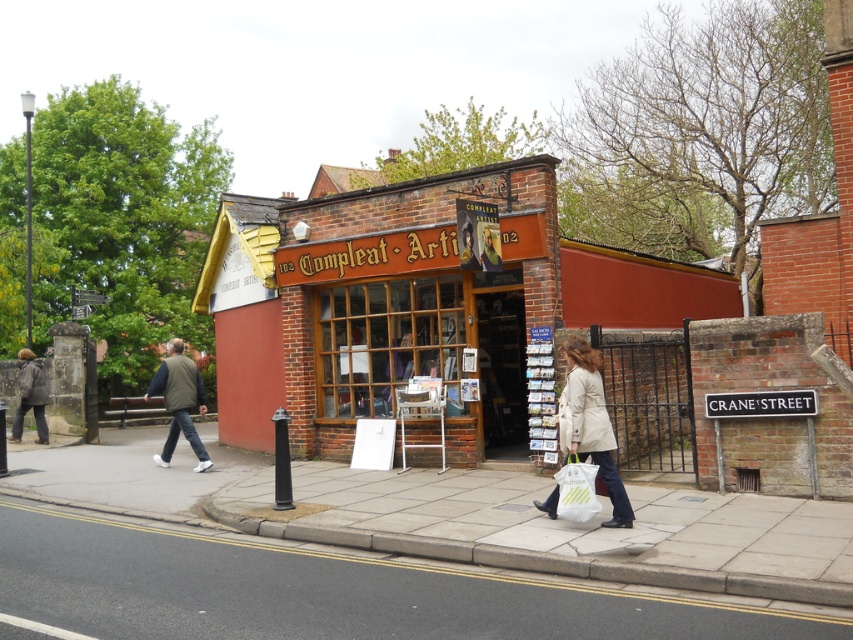
Who is more forward, (x=589, y=381) or (x=22, y=374)?

Point (x=589, y=381)

Does light beige coat at lower right have a greater height compared to dark gray jacket at lower left?

No.

Does point (598, 358) come farther from viewer compared to point (33, 404)?

No, (598, 358) is closer to viewer.

At what (x,y) coordinates should I click in order to perform the action: click on light beige coat at lower right. Please return your answer as a coordinate pair (x, y). The image size is (853, 640). Looking at the image, I should click on (590, 424).

Is brick storefront at center wider than dark gray jacket at lower left?

No.

Does brick storefront at center have a lesser height compared to dark gray jacket at lower left?

Yes.

You are a GUI agent. You are given a task and a screenshot of the screen. Output one action in this format:
    pyautogui.click(x=<x>, y=<y>)
    Task: Click on the brick storefront at center
    
    Given the screenshot: What is the action you would take?
    pyautogui.click(x=380, y=307)

You are a GUI agent. You are given a task and a screenshot of the screen. Output one action in this format:
    pyautogui.click(x=<x>, y=<y>)
    Task: Click on the brick storefront at center
    The height and width of the screenshot is (640, 853).
    Given the screenshot: What is the action you would take?
    pyautogui.click(x=380, y=307)

Can you confirm if green fabric jacket at lower left is shorter than smooth brown leather jacket at center?

Answer: Incorrect, green fabric jacket at lower left's height does not fall short of smooth brown leather jacket at center's.

Does green fabric jacket at lower left lie behind smooth brown leather jacket at center?

Yes, it is.

Is point (204, 397) closer to viewer compared to point (462, 230)?

That is False.

The image size is (853, 640). Identify the location of green fabric jacket at lower left. (178, 401).